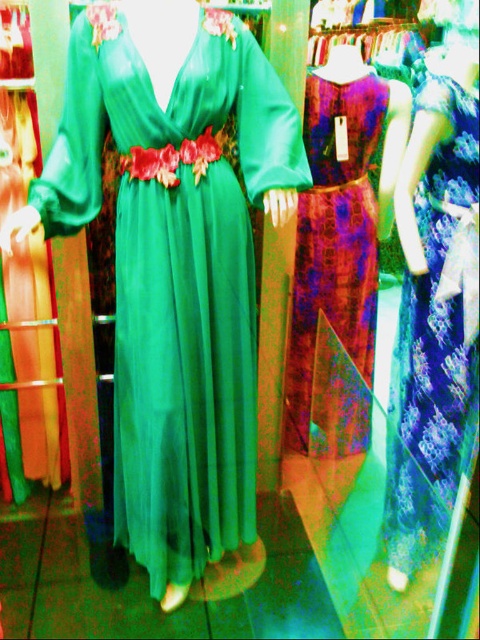
Question: Among these objects, which one is farthest from the camera?

Choices:
 (A) patterned silk dress at center
 (B) green satin dress at center

Answer: (A)

Question: Does blue floral dress at right have a larger size compared to patterned silk dress at center?

Choices:
 (A) yes
 (B) no

Answer: (B)

Question: Which point is closer to the camera taking this photo?

Choices:
 (A) (232, 420)
 (B) (322, 237)

Answer: (A)

Question: Which point appears closest to the camera in this image?

Choices:
 (A) (203, 394)
 (B) (369, 177)

Answer: (A)

Question: Does blue floral dress at right appear under patterned silk dress at center?

Choices:
 (A) no
 (B) yes

Answer: (B)

Question: Does blue floral dress at right appear under patterned silk dress at center?

Choices:
 (A) no
 (B) yes

Answer: (B)